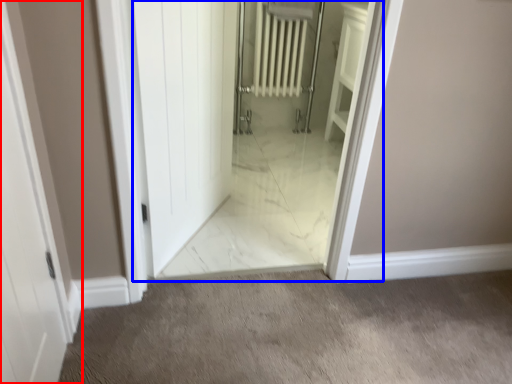
Question: Which of the following is the farthest to the observer, door (highlighted by a red box) or elevator (highlighted by a blue box)?

Choices:
 (A) door
 (B) elevator

Answer: (B)